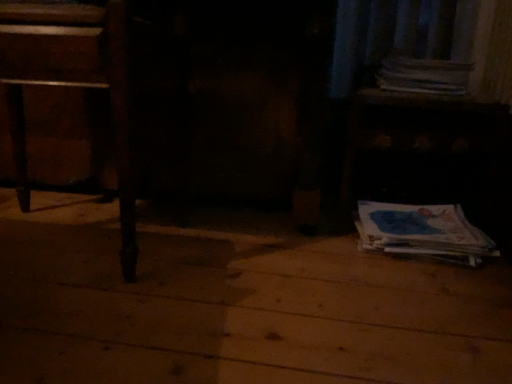
Question: Considering the positions of wooden table at lower right and wooden table at left in the image, is wooden table at lower right bigger or smaller than wooden table at left?

Choices:
 (A) big
 (B) small

Answer: (A)

Question: From their relative heights in the image, would you say wooden table at lower right is taller or shorter than wooden table at left?

Choices:
 (A) tall
 (B) short

Answer: (A)

Question: Which object is the farthest from the blue paper at lower right, the second paperback book viewed from the top?

Choices:
 (A) white paper at upper right, the 1th paperback book positioned from the top
 (B) wooden table at left
 (C) wooden table at lower right

Answer: (B)

Question: Which object is the closest to the wooden table at lower right?

Choices:
 (A) wooden table at left
 (B) white paper at upper right, which appears as the 2th paperback book when ordered from the bottom
 (C) blue paper at lower right, the second paperback book viewed from the top

Answer: (C)